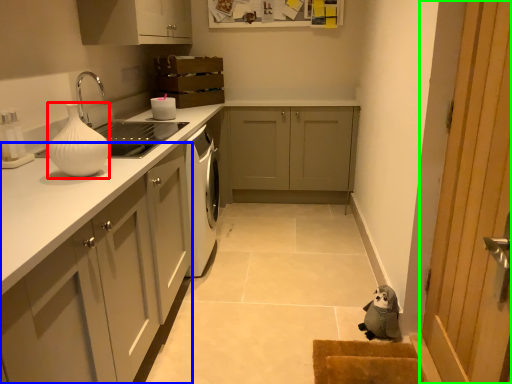
Question: Which object is positioned closest to vase (highlighted by a red box)? Select from cabinetry (highlighted by a blue box) and door (highlighted by a green box).

Choices:
 (A) cabinetry
 (B) door

Answer: (A)